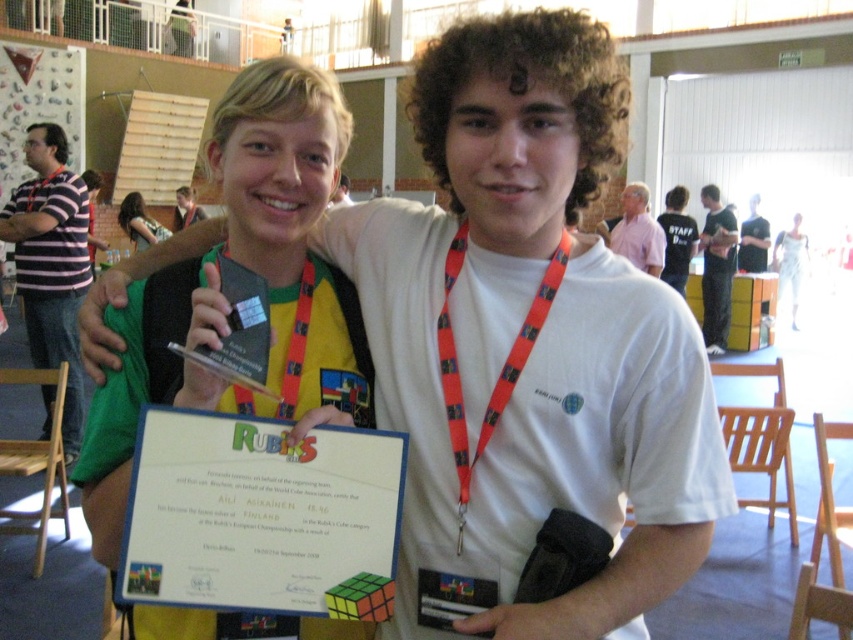
You are a photographer at the Rubik Cube competition. You need to adjust the lighting so that the orange fabric lanyard at center and the matte yellow necktie at upper center are both clearly visible. Which object should you focus on first to ensure proper exposure, considering their relative sizes?

The orange fabric lanyard at center is much taller than the matte yellow necktie at upper center, so you should focus on the orange fabric lanyard at center first to ensure proper exposure because it is larger and may require more light adjustment.

You are a photographer at the Rubik Cube competition. You need to focus your camera on the orange fabric lanyard at center and the matte yellow necktie at upper center. Which object is positioned lower in the image?

The orange fabric lanyard at center is located below the matte yellow necktie at upper center, so the orange fabric lanyard at center is positioned lower in the image.